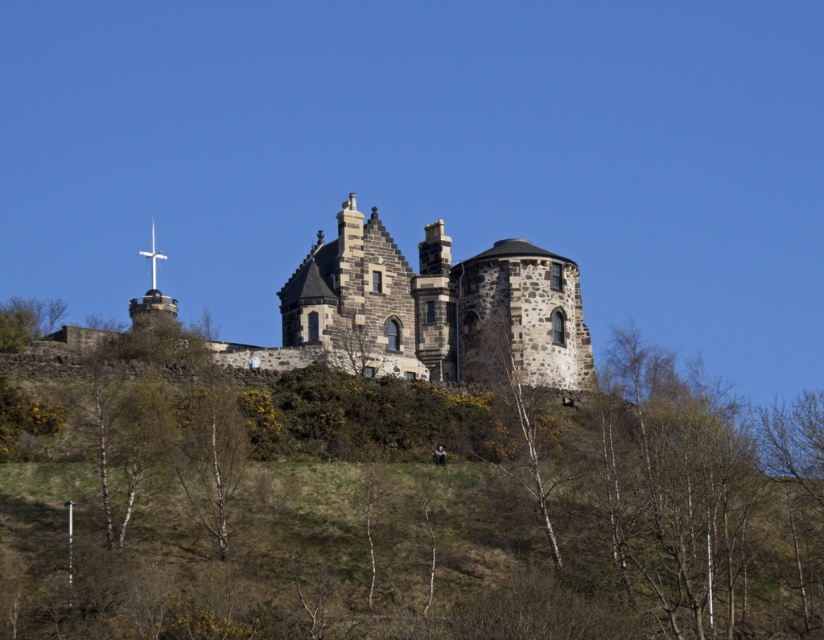
You are an artist planning to paint the scene of the historic stone building. You notice two trees at the center of the image. Which tree would likely cast a bigger shadow given their sizes? Please refer to the green leafy tree at center and the bare wood tree at center.

The green leafy tree at center is larger in size than the bare wood tree at center, so it would cast a bigger shadow.

You are an artist planning to paint the scene of the historic stone building. You notice two trees at the center of the image. Which tree has a wider spread when comparing the green leafy tree at center and the bare wood tree at center?

The green leafy tree at center has a wider spread than the bare wood tree at center as its width surpasses the latter.

You are standing at the base of the hill looking towards the historic stone building. You see the dark gray stone castle at center and the smooth white birch at lower center. Which object is positioned to the right side from your viewpoint?

The dark gray stone castle at center is to the right of the smooth white birch at lower center, so the castle is positioned to the right side from your viewpoint.